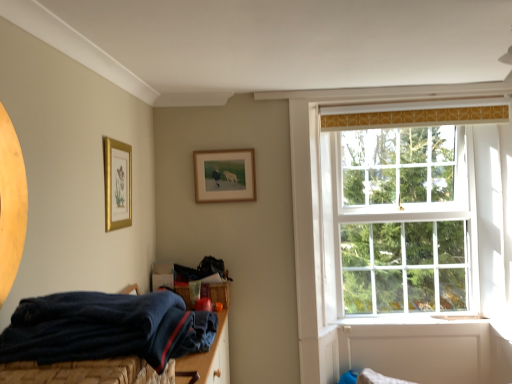
Measure the distance between point (x=131, y=191) and camera.

2.26 meters.

The height and width of the screenshot is (384, 512). Describe the element at coordinates (405, 220) in the screenshot. I see `white wooden window at upper right` at that location.

At what (x,y) coordinates should I click in order to perform the action: click on white wooden window at upper right. Please return your answer as a coordinate pair (x, y). Image resolution: width=512 pixels, height=384 pixels. Looking at the image, I should click on (405, 220).

Where is `gold framed picture at upper left, the 1th picture frame in the front-to-back sequence`? The height and width of the screenshot is (384, 512). gold framed picture at upper left, the 1th picture frame in the front-to-back sequence is located at coordinates (117, 184).

From the image's perspective, is wooden frame at upper center, which is counted as the 1th picture frame, starting from the right, under gold framed picture at upper left, which ranks as the 2th picture frame in back-to-front order?

No.

Is wooden frame at upper center, which is counted as the 1th picture frame, starting from the right, bigger than gold framed picture at upper left, which ranks as the 2th picture frame in back-to-front order?

Incorrect, wooden frame at upper center, which is counted as the 1th picture frame, starting from the right, is not larger than gold framed picture at upper left, which ranks as the 2th picture frame in back-to-front order.

Based on their positions, is wooden frame at upper center, placed as the 2th picture frame when sorted from front to back, located to the left or right of gold framed picture at upper left, which ranks as the 2th picture frame in back-to-front order?

In the image, wooden frame at upper center, placed as the 2th picture frame when sorted from front to back, appears on the right side of gold framed picture at upper left, which ranks as the 2th picture frame in back-to-front order.

Is gold framed picture at upper left, the second picture frame viewed from the right, positioned in front of wooden frame at upper center, placed as the 2th picture frame when sorted from front to back?

That is True.

Who is shorter, gold framed picture at upper left, the second picture frame viewed from the right, or wooden frame at upper center, placed as the 2th picture frame when sorted from front to back?

With less height is wooden frame at upper center, placed as the 2th picture frame when sorted from front to back.

Choose the correct answer: Is gold framed picture at upper left, the 1th picture frame in the front-to-back sequence, inside wooden frame at upper center, which is counted as the 1th picture frame, starting from the right, or outside it?

gold framed picture at upper left, the 1th picture frame in the front-to-back sequence, cannot be found inside wooden frame at upper center, which is counted as the 1th picture frame, starting from the right.

Considering the sizes of objects gold framed picture at upper left, placed as the first picture frame when sorted from left to right, and wooden frame at upper center, the 2th picture frame in the left-to-right sequence, in the image provided, who is thinner, gold framed picture at upper left, placed as the first picture frame when sorted from left to right, or wooden frame at upper center, the 2th picture frame in the left-to-right sequence,?

wooden frame at upper center, the 2th picture frame in the left-to-right sequence, is thinner.

From a real-world perspective, is navy blue fabric bed at lower left positioned over gold framed picture at upper left, the second picture frame viewed from the right, based on gravity?

Incorrect, from a real-world perspective, navy blue fabric bed at lower left is lower than gold framed picture at upper left, the second picture frame viewed from the right.

Find the location of `bed located in front of the gold framed picture at upper left, the second picture frame viewed from the right`. bed located in front of the gold framed picture at upper left, the second picture frame viewed from the right is located at coordinates (129, 368).

From the picture: Would you say gold framed picture at upper left, placed as the first picture frame when sorted from left to right, is part of navy blue fabric bed at lower left's contents?

That's incorrect, gold framed picture at upper left, placed as the first picture frame when sorted from left to right, is not inside navy blue fabric bed at lower left.

Is navy blue fabric bed at lower left bigger than gold framed picture at upper left, the second picture frame viewed from the right?

Yes, navy blue fabric bed at lower left is bigger than gold framed picture at upper left, the second picture frame viewed from the right.

Is navy blue fabric bed at lower left surrounding white wooden window at upper right?

That's incorrect, white wooden window at upper right is not inside navy blue fabric bed at lower left.

Between navy blue fabric bed at lower left and white wooden window at upper right, which one has larger size?

With larger size is white wooden window at upper right.

Considering the sizes of navy blue fabric bed at lower left and white wooden window at upper right in the image, is navy blue fabric bed at lower left wider or thinner than white wooden window at upper right?

Clearly, navy blue fabric bed at lower left has more width compared to white wooden window at upper right.

In the image, is navy blue fabric bed at lower left on the left side or the right side of white wooden window at upper right?

navy blue fabric bed at lower left is positioned on white wooden window at upper right's left side.

Consider the image. Which object is further away from the camera taking this photo, gold framed picture at upper left, the 1th picture frame in the front-to-back sequence, or navy blue fabric bed at lower left?

gold framed picture at upper left, the 1th picture frame in the front-to-back sequence, is more distant.

How different are the orientations of gold framed picture at upper left, the second picture frame viewed from the right, and navy blue fabric bed at lower left in degrees?

The angle between the facing direction of gold framed picture at upper left, the second picture frame viewed from the right, and the facing direction of navy blue fabric bed at lower left is 1.87 degrees.

Who is smaller, gold framed picture at upper left, the second picture frame viewed from the right, or navy blue fabric bed at lower left?

gold framed picture at upper left, the second picture frame viewed from the right, is smaller.

Is white wooden window at upper right beside wooden frame at upper center, the 2th picture frame in the left-to-right sequence?

white wooden window at upper right and wooden frame at upper center, the 2th picture frame in the left-to-right sequence, are not in contact.

Looking at this image, from the image's perspective, does white wooden window at upper right appear lower than wooden frame at upper center, which is the 1th picture frame from back to front?

Yes.

Is white wooden window at upper right to the right of wooden frame at upper center, which is counted as the 1th picture frame, starting from the right, from the viewer's perspective?

Yes.

Considering the sizes of objects white wooden window at upper right and wooden frame at upper center, which is the 1th picture frame from back to front, in the image provided, who is shorter, white wooden window at upper right or wooden frame at upper center, which is the 1th picture frame from back to front,?

Standing shorter between the two is wooden frame at upper center, which is the 1th picture frame from back to front.

Is white wooden window at upper right in contact with gold framed picture at upper left, the 1th picture frame in the front-to-back sequence?

They are not placed beside each other.

From a real-world perspective, starting from the white wooden window at upper right, which picture frame is the 1st one vertically above it? Please provide its 2D coordinates.

[(117, 184)]

How many degrees apart are the facing directions of white wooden window at upper right and gold framed picture at upper left, placed as the first picture frame when sorted from left to right?

They differ by 92.1 degrees in their facing directions.

From a real-world perspective, relative to gold framed picture at upper left, the 1th picture frame in the front-to-back sequence, is white wooden window at upper right vertically above or below?

white wooden window at upper right is below gold framed picture at upper left, the 1th picture frame in the front-to-back sequence.

Where is `picture frame above the gold framed picture at upper left, which ranks as the 2th picture frame in back-to-front order (from the image's perspective)`? picture frame above the gold framed picture at upper left, which ranks as the 2th picture frame in back-to-front order (from the image's perspective) is located at coordinates (224, 175).

Identify the location of picture frame in front of the wooden frame at upper center, which is counted as the 1th picture frame, starting from the right. This screenshot has height=384, width=512. (117, 184).

Based on their spatial positions, is white wooden window at upper right or navy blue fabric bed at lower left closer to gold framed picture at upper left, the 1th picture frame in the front-to-back sequence?

The object closer to gold framed picture at upper left, the 1th picture frame in the front-to-back sequence, is navy blue fabric bed at lower left.

When comparing their distances from wooden frame at upper center, the 2th picture frame in the left-to-right sequence, does white wooden window at upper right or gold framed picture at upper left, the 1th picture frame in the front-to-back sequence, seem further?

white wooden window at upper right is positioned further to the anchor wooden frame at upper center, the 2th picture frame in the left-to-right sequence.

From the image, which object appears to be nearer to gold framed picture at upper left, which ranks as the 2th picture frame in back-to-front order, white wooden window at upper right or wooden frame at upper center, which is counted as the 1th picture frame, starting from the right?

wooden frame at upper center, which is counted as the 1th picture frame, starting from the right, is closer to gold framed picture at upper left, which ranks as the 2th picture frame in back-to-front order.

From the image, which object appears to be farther from wooden frame at upper center, which is counted as the 1th picture frame, starting from the right, gold framed picture at upper left, placed as the first picture frame when sorted from left to right, or navy blue fabric bed at lower left?

Based on the image, navy blue fabric bed at lower left appears to be further to wooden frame at upper center, which is counted as the 1th picture frame, starting from the right.

Considering their positions, is wooden frame at upper center, the 2th picture frame in the left-to-right sequence, positioned further to navy blue fabric bed at lower left than white wooden window at upper right?

Among the two, white wooden window at upper right is located further to navy blue fabric bed at lower left.

When comparing their distances from gold framed picture at upper left, which ranks as the 2th picture frame in back-to-front order, does wooden frame at upper center, which is counted as the 1th picture frame, starting from the right, or navy blue fabric bed at lower left seem closer?

The object closer to gold framed picture at upper left, which ranks as the 2th picture frame in back-to-front order, is wooden frame at upper center, which is counted as the 1th picture frame, starting from the right.

Looking at the image, which one is located closer to navy blue fabric bed at lower left, gold framed picture at upper left, the second picture frame viewed from the right, or white wooden window at upper right?

gold framed picture at upper left, the second picture frame viewed from the right, is positioned closer to the anchor navy blue fabric bed at lower left.

Estimate the real-world distances between objects in this image. Which object is closer to white wooden window at upper right, wooden frame at upper center, placed as the 2th picture frame when sorted from front to back, or navy blue fabric bed at lower left?

The object closer to white wooden window at upper right is wooden frame at upper center, placed as the 2th picture frame when sorted from front to back.

You are a GUI agent. You are given a task and a screenshot of the screen. Output one action in this format:
    pyautogui.click(x=<x>, y=<y>)
    Task: Click on the picture frame between gold framed picture at upper left, the second picture frame viewed from the right, and white wooden window at upper right, in the horizontal direction
    The image size is (512, 384).
    Given the screenshot: What is the action you would take?
    pyautogui.click(x=224, y=175)

Locate an element on the screen. This screenshot has height=384, width=512. picture frame located between navy blue fabric bed at lower left and wooden frame at upper center, which is counted as the 1th picture frame, starting from the right, in the depth direction is located at coordinates (117, 184).